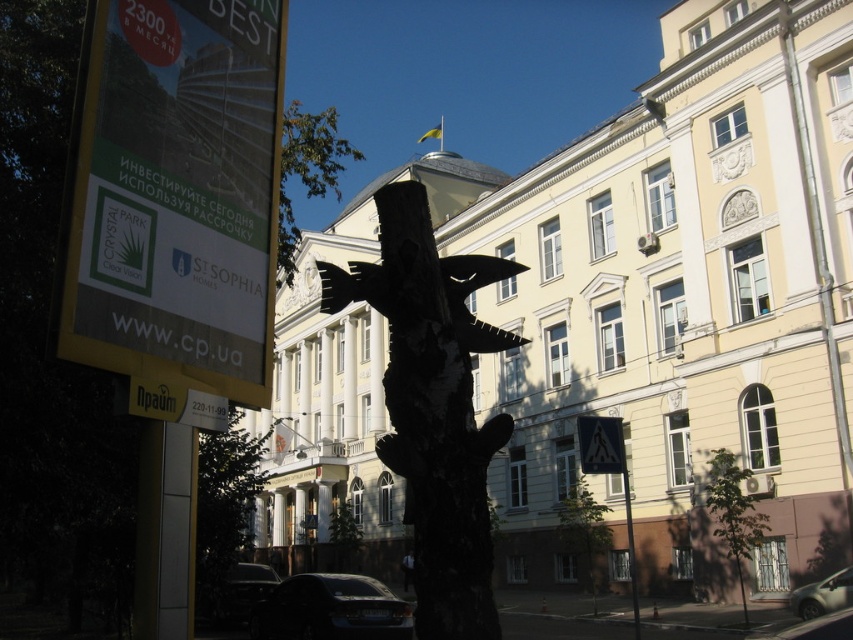
Question: In this image, where is black matte sculpture at center located relative to green leafy tree at upper center?

Choices:
 (A) above
 (B) below

Answer: (B)

Question: Is the position of wooden sculpture at center less distant than that of black plastic triangle at lower right?

Choices:
 (A) yes
 (B) no

Answer: (A)

Question: From the image, what is the correct spatial relationship of black matte sculpture at center in relation to dark matte car at lower center?

Choices:
 (A) above
 (B) below

Answer: (A)

Question: Which object is the closest to the metallic silver car at lower right?

Choices:
 (A) black plastic triangle at lower right
 (B) dark matte car at lower center
 (C) shiny black car at lower left
 (D) yellow paper sign at upper left

Answer: (A)

Question: Among these objects, which one is farthest from the camera?

Choices:
 (A) green textured tree at center
 (B) green leafy tree at upper center

Answer: (A)

Question: Which point is farther to the camera?

Choices:
 (A) (816, 580)
 (B) (601, 536)
 (C) (361, 589)

Answer: (B)